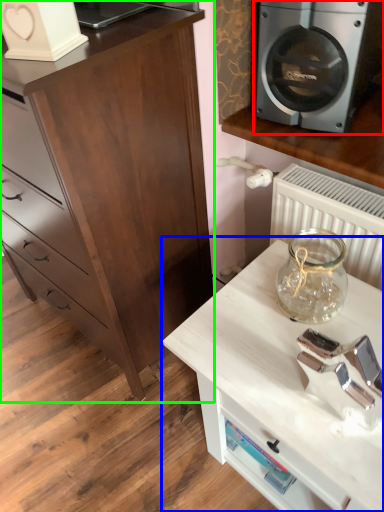
Question: Which object is the farthest from home appliance (highlighted by a red box)? Choose among these: table (highlighted by a blue box) or chest of drawers (highlighted by a green box).

Choices:
 (A) table
 (B) chest of drawers

Answer: (A)